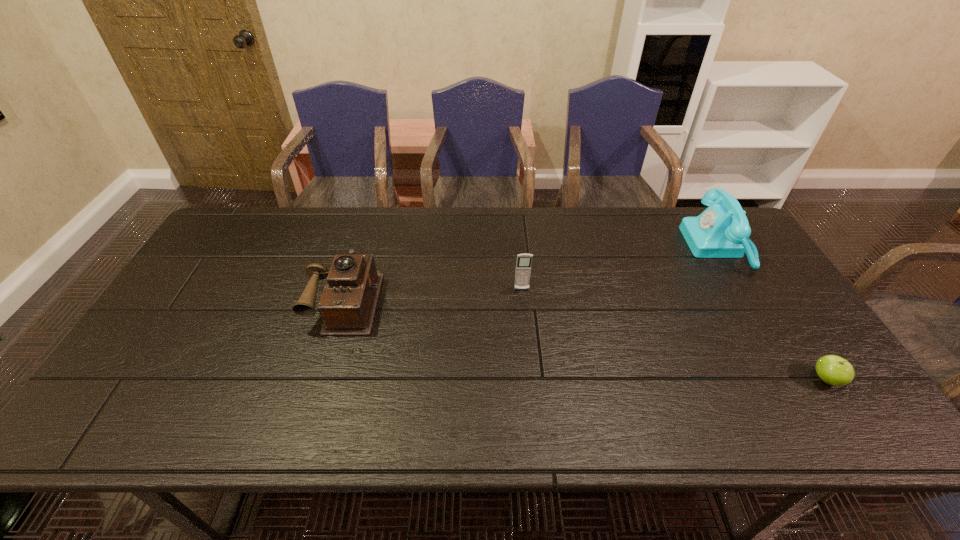
Locate an element on the screen. unoccupied area between the cellular telephone and the phonograph_record is located at coordinates (434, 295).

At what (x,y) coordinates should I click in order to perform the action: click on empty location between the phonograph_record and the third object from right to left. Please return your answer as a coordinate pair (x, y). Looking at the image, I should click on [x=434, y=295].

At what (x,y) coordinates should I click in order to perform the action: click on vacant region between the apple and the telephone. Please return your answer as a coordinate pair (x, y). Looking at the image, I should click on (773, 313).

Locate an element on the screen. free space between the leftmost object and the cellular telephone is located at coordinates (434, 295).

Where is `empty space that is in between the cellular telephone and the leftmost object`? This screenshot has height=540, width=960. empty space that is in between the cellular telephone and the leftmost object is located at coordinates (434, 295).

The width and height of the screenshot is (960, 540). I want to click on vacant space that's between the shortest object and the leftmost object, so click(x=586, y=340).

The width and height of the screenshot is (960, 540). Identify the location of vacant area that lies between the phonograph_record and the shortest object. (586, 340).

This screenshot has height=540, width=960. In order to click on free space between the telephone and the apple in this screenshot , I will do `click(773, 313)`.

Identify which object is located as the nearest to the phonograph_record. Please provide its 2D coordinates. Your answer should be formatted as a tuple, i.e. [(x, y)], where the tuple contains the x and y coordinates of a point satisfying the conditions above.

[(523, 266)]

Identify which object is the nearest to the cellular telephone. Please provide its 2D coordinates. Your answer should be formatted as a tuple, i.e. [(x, y)], where the tuple contains the x and y coordinates of a point satisfying the conditions above.

[(347, 306)]